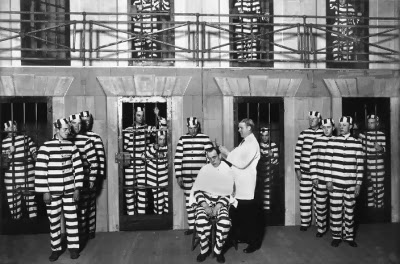
Identify the location of chair. The image size is (400, 264). (232, 237), (198, 237).